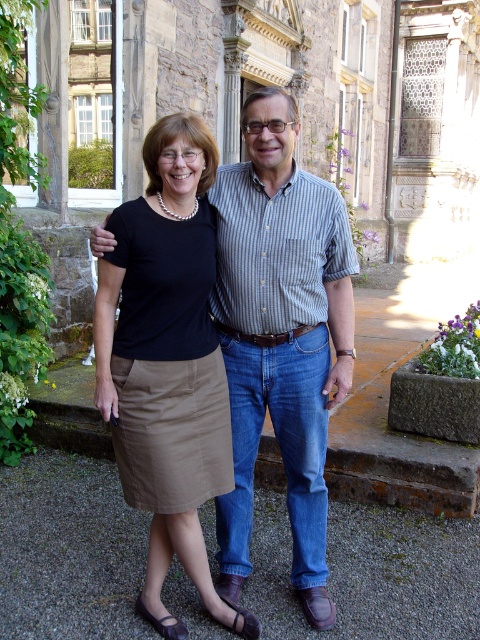
Who is positioned more to the right, striped cotton shirt at center or matte khaki skirt at center?

striped cotton shirt at center is more to the right.

Which is in front, point (310, 348) or point (132, 504)?

Point (132, 504) is in front.

This screenshot has height=640, width=480. I want to click on striped cotton shirt at center, so click(280, 337).